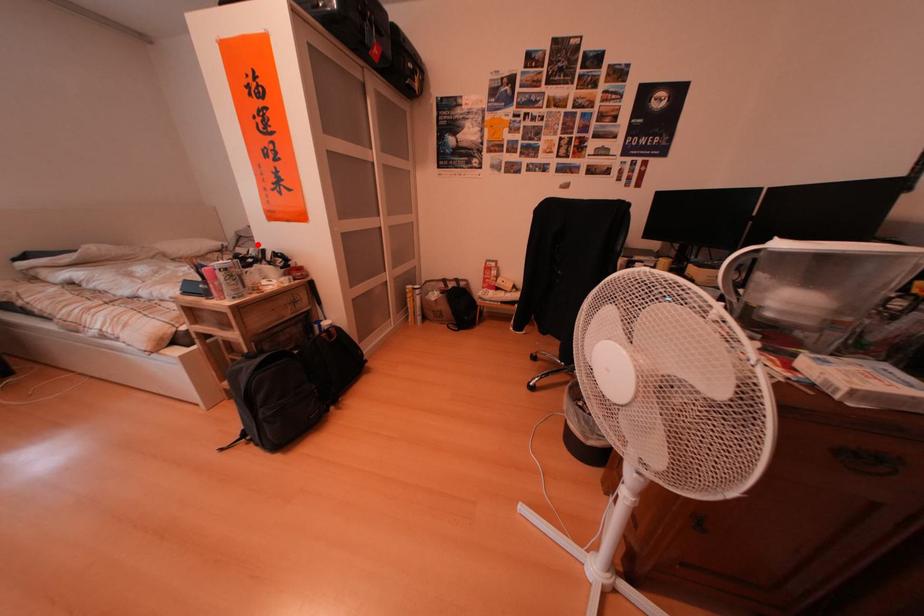
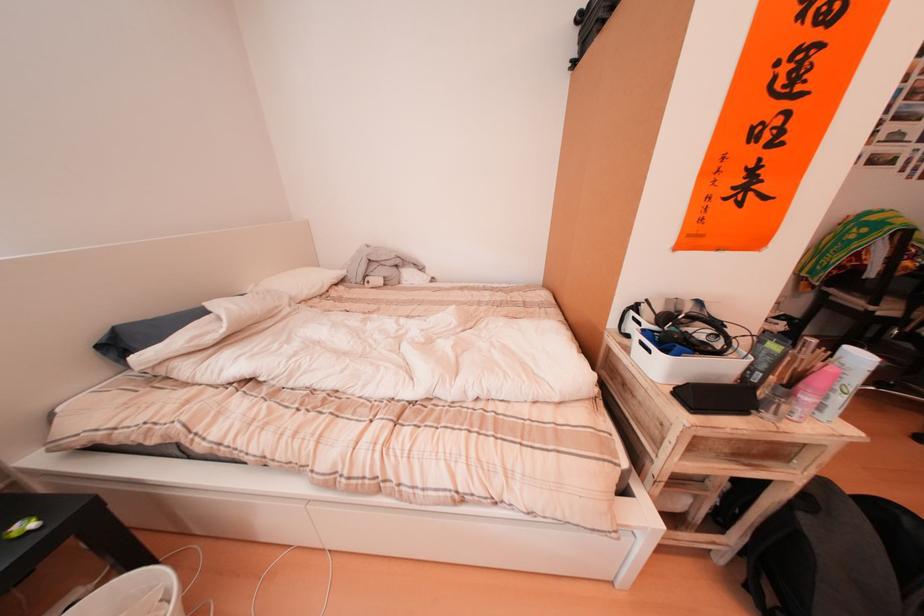
In the second image, find the point that corresponds to the highlighted location in the first image.

(390, 270)